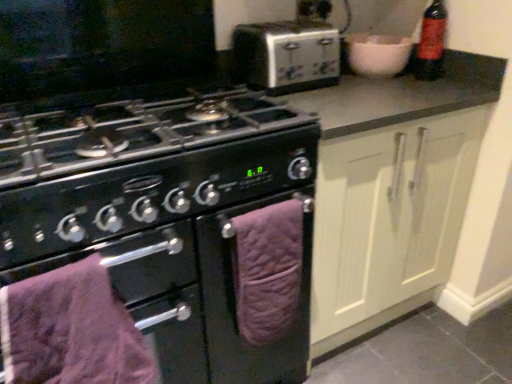
Question: Looking at their shapes, would you say silver metallic toaster at upper center is wider or thinner than purple quilted towel at lower center, the 2th oven viewed from the left?

Choices:
 (A) wide
 (B) thin

Answer: (A)

Question: Relative to purple quilted towel at lower center, the first oven viewed from the right, is silver metallic toaster at upper center in front or behind?

Choices:
 (A) front
 (B) behind

Answer: (B)

Question: Which object is positioned closest to the red matte bottle at upper right?

Choices:
 (A) cream matte cabinet doors at center-right
 (B) silver metallic toaster at upper center
 (C) purple quilted towel at lower left
 (D) black matte oven at center, positioned as the 1th oven in left-to-right order
 (E) purple quilted towel at lower center, the first oven viewed from the right

Answer: (B)

Question: Estimate the real-world distances between objects in this image. Which object is farther from the purple quilted towel at lower left?

Choices:
 (A) red matte bottle at upper right
 (B) cream matte cabinet doors at center-right
 (C) purple quilted towel at lower center, the 2th oven viewed from the left
 (D) silver metallic toaster at upper center
 (E) black matte oven at center, which is counted as the 2th oven, starting from the right

Answer: (A)